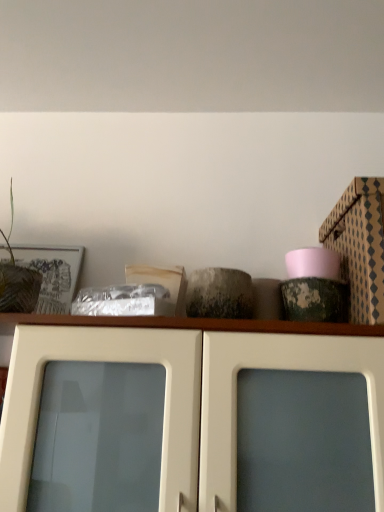
Question: Considering the relative sizes of white glossy cabinet doors at center and patterned cardboard box at upper right in the image provided, is white glossy cabinet doors at center wider than patterned cardboard box at upper right?

Choices:
 (A) no
 (B) yes

Answer: (B)

Question: Would you say white glossy cabinet doors at center is outside patterned cardboard box at upper right?

Choices:
 (A) yes
 (B) no

Answer: (A)

Question: Is white glossy cabinet doors at center thinner than patterned cardboard box at upper right?

Choices:
 (A) no
 (B) yes

Answer: (A)

Question: From the image's perspective, is white glossy cabinet doors at center below patterned cardboard box at upper right?

Choices:
 (A) yes
 (B) no

Answer: (A)

Question: Can you confirm if white glossy cabinet doors at center is bigger than patterned cardboard box at upper right?

Choices:
 (A) no
 (B) yes

Answer: (B)

Question: Can you confirm if white glossy cabinet doors at center is taller than patterned cardboard box at upper right?

Choices:
 (A) yes
 (B) no

Answer: (A)

Question: From the image's perspective, does patterned cardboard box at upper right appear lower than white glossy cabinet doors at center?

Choices:
 (A) yes
 (B) no

Answer: (B)

Question: From a real-world perspective, is patterned cardboard box at upper right located higher than white glossy cabinet doors at center?

Choices:
 (A) no
 (B) yes

Answer: (B)

Question: Could you tell me if patterned cardboard box at upper right is facing white glossy cabinet doors at center?

Choices:
 (A) no
 (B) yes

Answer: (A)

Question: Is patterned cardboard box at upper right beside white glossy cabinet doors at center?

Choices:
 (A) yes
 (B) no

Answer: (B)

Question: Would you say patterned cardboard box at upper right contains white glossy cabinet doors at center?

Choices:
 (A) yes
 (B) no

Answer: (B)

Question: Is patterned cardboard box at upper right looking in the opposite direction of white glossy cabinet doors at center?

Choices:
 (A) no
 (B) yes

Answer: (A)

Question: From a real-world perspective, is patterned cardboard box at upper right on top of green leafy plant at left?

Choices:
 (A) no
 (B) yes

Answer: (B)